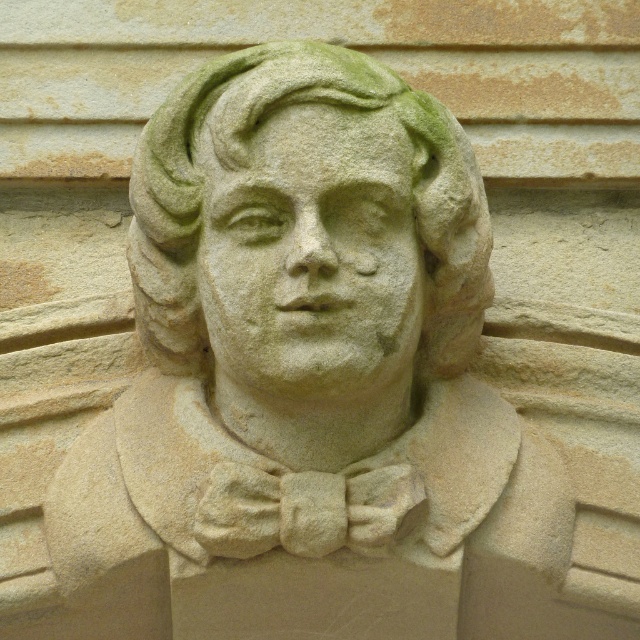
You are an art conservator assessing the stone sculptures in the image. The green stone face at center and the green stone bust at center are both weathered. Which one has a smaller area covered by the greenish patina?

The green stone face at center occupies less space than the green stone bust at center, so the green stone face at center has a smaller area covered by the greenish patina.

You are an art conservator examining the stone sculpture. You notice two parts of the sculpture labeled as the green stone face at center and the green stone bust at center. Which part has a greater height?

The green stone bust at center is taller than the green stone face at center, so the green stone bust at center has a greater height.